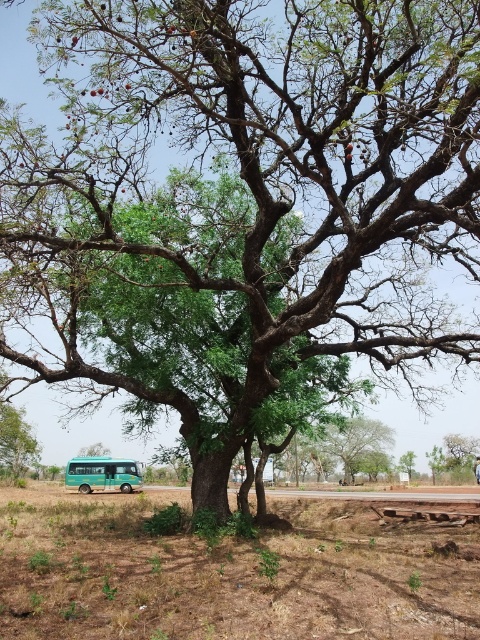
Does green matte bus at lower left appear under green leafy tree at lower left?

Answer: Yes.

Does green matte bus at lower left appear over green leafy tree at lower left?

No.

Which is in front, point (91, 458) or point (12, 474)?

Point (91, 458)

The height and width of the screenshot is (640, 480). Find the location of `green matte bus at lower left`. green matte bus at lower left is located at coordinates (103, 474).

Which is more to the right, brown dry soil at lower left or green leafy tree at lower left?

From the viewer's perspective, brown dry soil at lower left appears more on the right side.

This screenshot has height=640, width=480. Describe the element at coordinates (229, 573) in the screenshot. I see `brown dry soil at lower left` at that location.

What are the coordinates of `brown dry soil at lower left` in the screenshot? It's located at (229, 573).

Between point (87, 477) and point (412, 467), which one is positioned behind?

Point (412, 467)

Between green matte bus at lower left and green leafy tree at center, which one appears on the right side from the viewer's perspective?

Positioned to the right is green leafy tree at center.

This screenshot has width=480, height=640. Find the location of `green matte bus at lower left`. green matte bus at lower left is located at coordinates (103, 474).

I want to click on green matte bus at lower left, so click(103, 474).